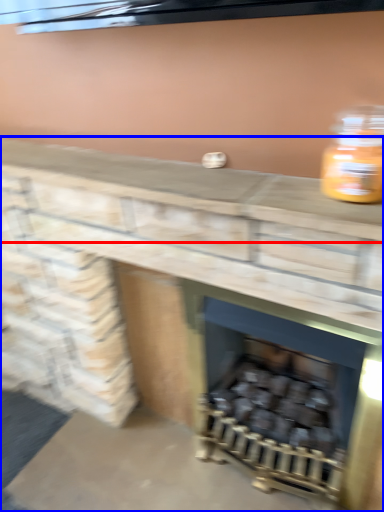
Question: Among these objects, which one is farthest to the camera, counter top (highlighted by a red box) or fireplace (highlighted by a blue box)?

Choices:
 (A) counter top
 (B) fireplace

Answer: (A)